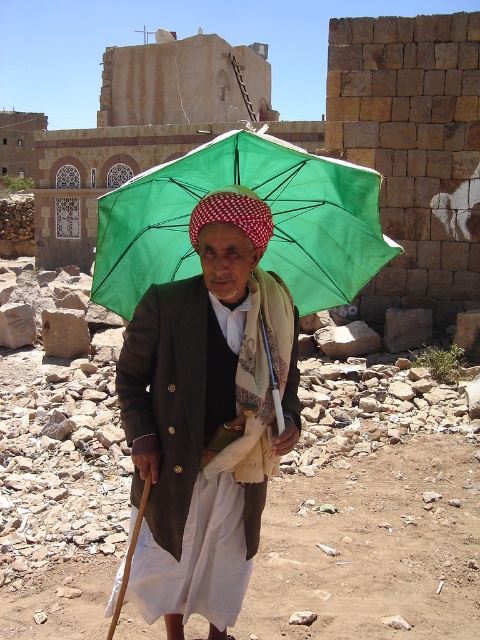
Question: Is matte green umbrella at center below green fabric umbrella at center?

Choices:
 (A) yes
 (B) no

Answer: (A)

Question: Which point is farther to the camera?

Choices:
 (A) (128, 282)
 (B) (236, 394)

Answer: (A)

Question: Which of the following is the closest to the observer?

Choices:
 (A) (115, 221)
 (B) (264, 244)

Answer: (B)

Question: Does matte green umbrella at center have a greater width compared to green fabric umbrella at center?

Choices:
 (A) yes
 (B) no

Answer: (B)

Question: From the image, what is the correct spatial relationship of matte green umbrella at center in relation to green fabric umbrella at center?

Choices:
 (A) right
 (B) left

Answer: (A)

Question: Which point is farther from the camera taking this photo?

Choices:
 (A) 319,196
 (B) 191,408
 (C) 210,230

Answer: (A)